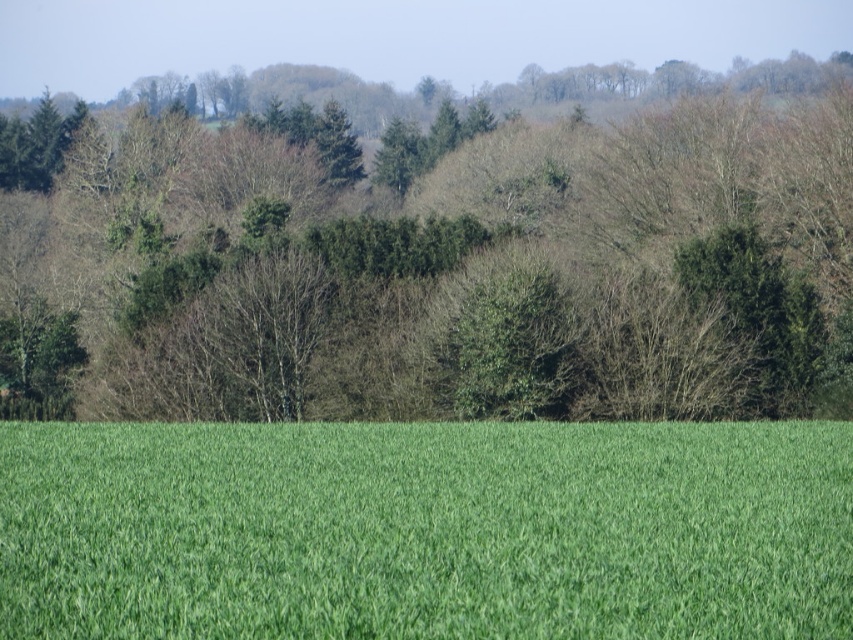
You are standing in a field and see both the green leafy trees at center and the green grass at center. Which object is closer to you?

The green leafy trees at center are closer to you because they are positioned further to the viewer than the green grass at center.

You are a farmer standing in the middle of the green grass at center. You want to reach the green leafy trees at center to check their health. Which direction should you walk to get there?

The green leafy trees at center is positioned on the left side of green grass at center, so you should walk to the left to reach them.